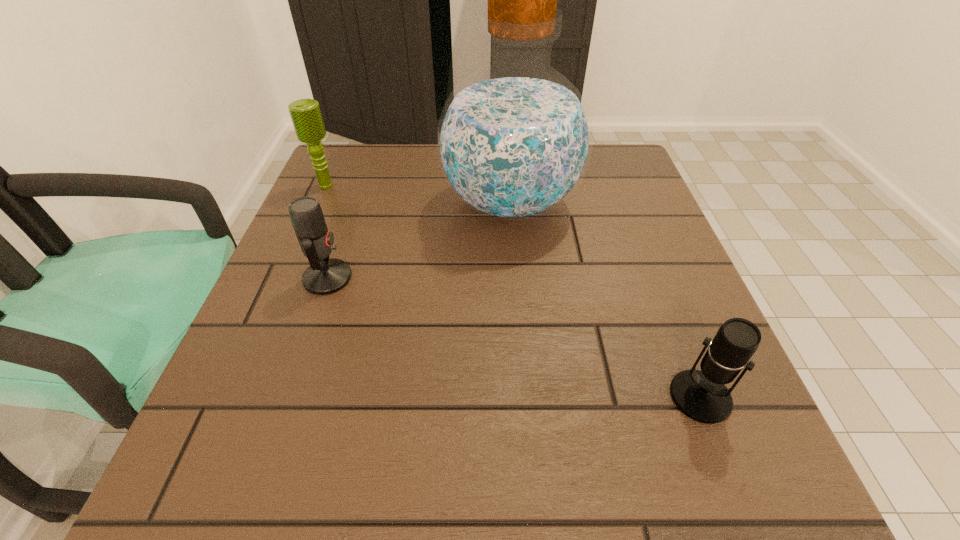
Locate an element on the screen. The image size is (960, 540). the second object from right to left is located at coordinates (514, 140).

Identify the location of water jug. The width and height of the screenshot is (960, 540). (514, 140).

Locate an element on the screen. Image resolution: width=960 pixels, height=540 pixels. the leftmost microphone is located at coordinates (306, 116).

Image resolution: width=960 pixels, height=540 pixels. Find the location of `the farthest microphone`. the farthest microphone is located at coordinates (x=306, y=116).

Find the location of a particular element. This screenshot has height=540, width=960. the third object from right to left is located at coordinates (324, 276).

Identify the location of the third farthest object. Image resolution: width=960 pixels, height=540 pixels. (324, 276).

Identify the location of the nearest object. The image size is (960, 540). (701, 395).

Locate an element on the screen. This screenshot has width=960, height=540. the nearest microphone is located at coordinates (701, 395).

In order to click on free space located 0.070m on the front of the water jug in this screenshot , I will do `click(516, 274)`.

This screenshot has height=540, width=960. What are the coordinates of `vacant space located on the right of the leftmost microphone` in the screenshot? It's located at (393, 185).